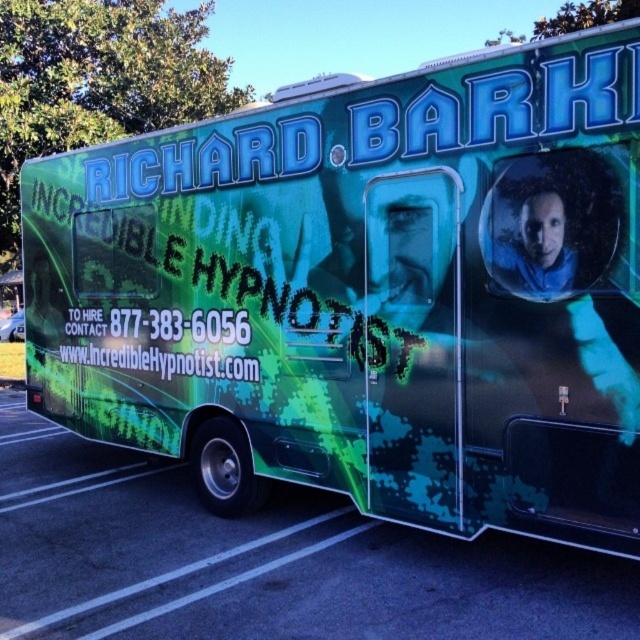
You are standing in front of the promotional vehicle described. The green camouflage truck at lower left is part of this setup. If you want to take a photo of the entire vehicle without moving, will you be able to capture it in one frame?

The green camouflage truck at lower left is 4.66 meters away from viewer. Since the distance is sufficient to capture the entire vehicle in one frame, you can take the photo without moving.

You are a photographer trying to capture the promotional vehicle in the image. You notice the green camouflage truck at lower left and the white text at center. Which object should you focus on first if you want to emphasize the smaller one in your photo?

The green camouflage truck at lower left is smaller compared to the white text at center, so you should focus on the green camouflage truck at lower left first to emphasize its smaller size in the photo.

You are a photographer positioned in front of the green camouflage truck at lower left and the white text at center. Which object will appear larger in your camera view?

The green camouflage truck at lower left is closer to the viewer than the white text at center, so it will appear larger in the camera view.